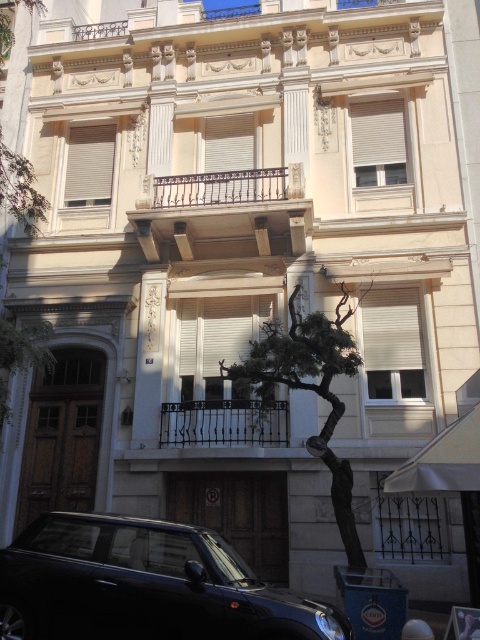
Question: Is shiny black car at lower left smaller than green textured tree at center?

Choices:
 (A) yes
 (B) no

Answer: (A)

Question: Among these points, which one is farthest from the camera?

Choices:
 (A) (177, 596)
 (B) (268, 348)

Answer: (B)

Question: Can you confirm if shiny black car at lower left is positioned below green textured tree at center?

Choices:
 (A) no
 (B) yes

Answer: (B)

Question: Which point is farther from the camera taking this photo?

Choices:
 (A) (319, 456)
 (B) (240, 600)

Answer: (A)

Question: Does shiny black car at lower left appear under green textured tree at center?

Choices:
 (A) no
 (B) yes

Answer: (B)

Question: Among these points, which one is farthest from the camera?

Choices:
 (A) (276, 624)
 (B) (343, 362)

Answer: (B)